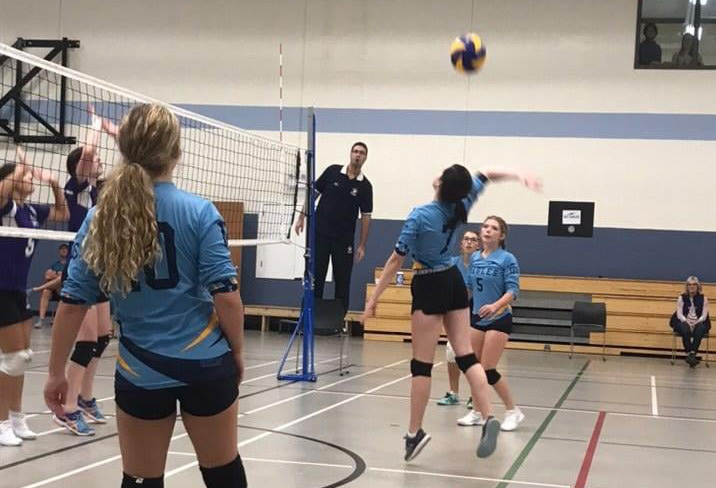
Identify the location of floor. This screenshot has width=716, height=488. (614, 395).